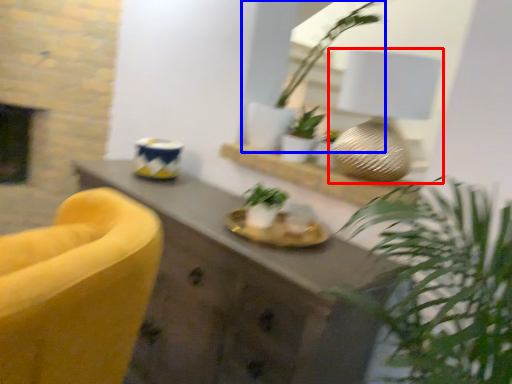
Question: Which object appears closest to the camera in this image, table lamp (highlighted by a red box) or houseplant (highlighted by a blue box)?

Choices:
 (A) table lamp
 (B) houseplant

Answer: (A)